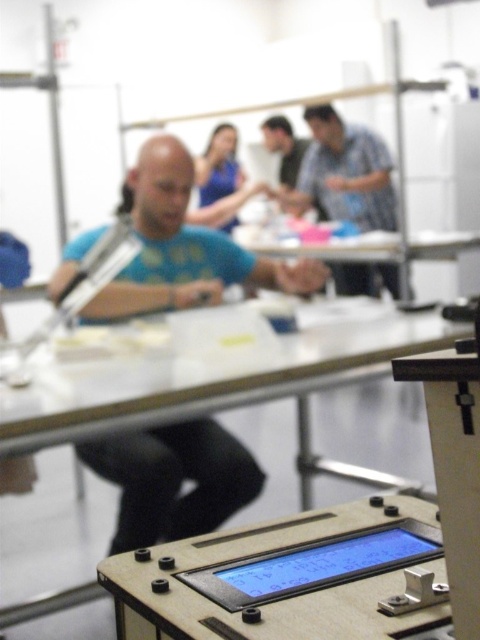
You are standing in the laboratory depicted in the image. You need to locate the matte blue shirt at upper center. Where exactly is it positioned in terms of coordinates?

The matte blue shirt at upper center is positioned at coordinates point [345,173].